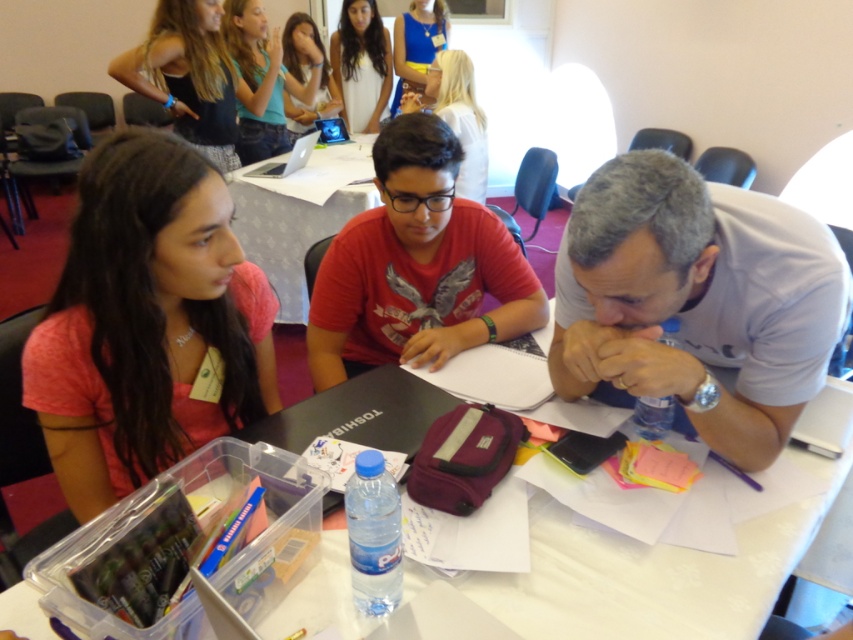
Question: Can you confirm if pink matte shirt at left is positioned to the left of clear plastic container at lower left?

Choices:
 (A) no
 (B) yes

Answer: (B)

Question: Which point is farther to the camera?

Choices:
 (A) clear plastic container at lower left
 (B) black plastic table at center
 (C) white matte shirt at center

Answer: (B)

Question: Can you confirm if pink matte shirt at left is wider than red matte shirt at center?

Choices:
 (A) no
 (B) yes

Answer: (A)

Question: Based on their relative distances, which object is farther from the clear plastic container at lower left?

Choices:
 (A) black plastic table at center
 (B) red matte shirt at center

Answer: (A)

Question: Is pink matte shirt at left closer to the viewer compared to clear plastic container at lower left?

Choices:
 (A) yes
 (B) no

Answer: (B)

Question: Which object appears farthest from the camera in this image?

Choices:
 (A) red matte shirt at center
 (B) clear plastic container at lower left

Answer: (A)